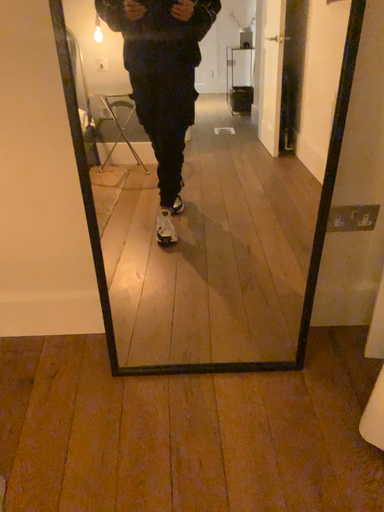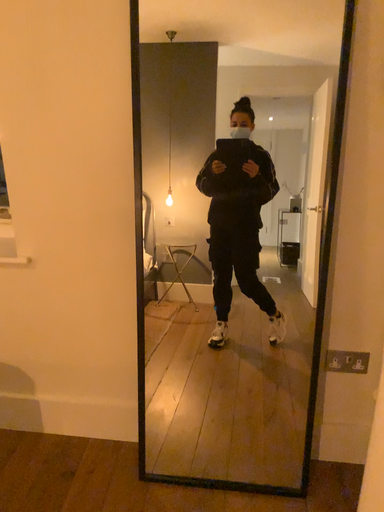
Question: How did the camera likely rotate when shooting the video?

Choices:
 (A) rotated downward
 (B) rotated upward

Answer: (B)